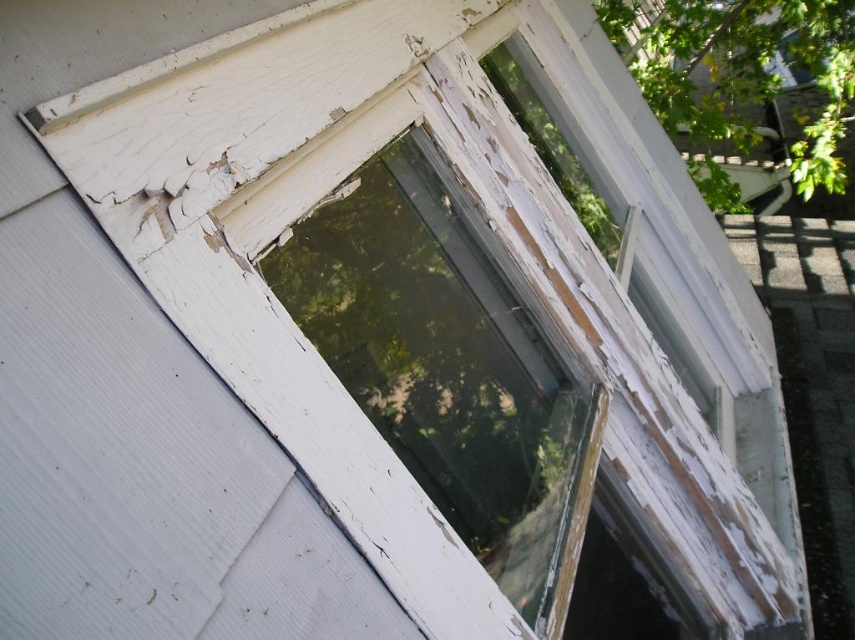
Based on the photo, between transparent glass window at center and green leafy tree at upper right, which one appears on the left side from the viewer's perspective?

Positioned to the left is transparent glass window at center.

Between point (423, 285) and point (739, 128), which one is positioned behind?

The point (739, 128) is more distant.

This screenshot has width=855, height=640. Find the location of `transparent glass window at center`. transparent glass window at center is located at coordinates (449, 371).